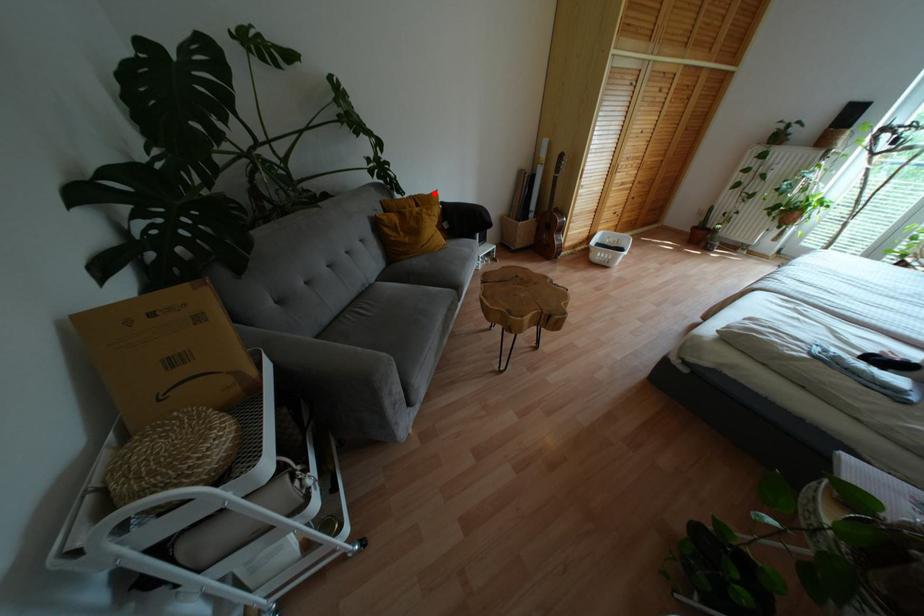
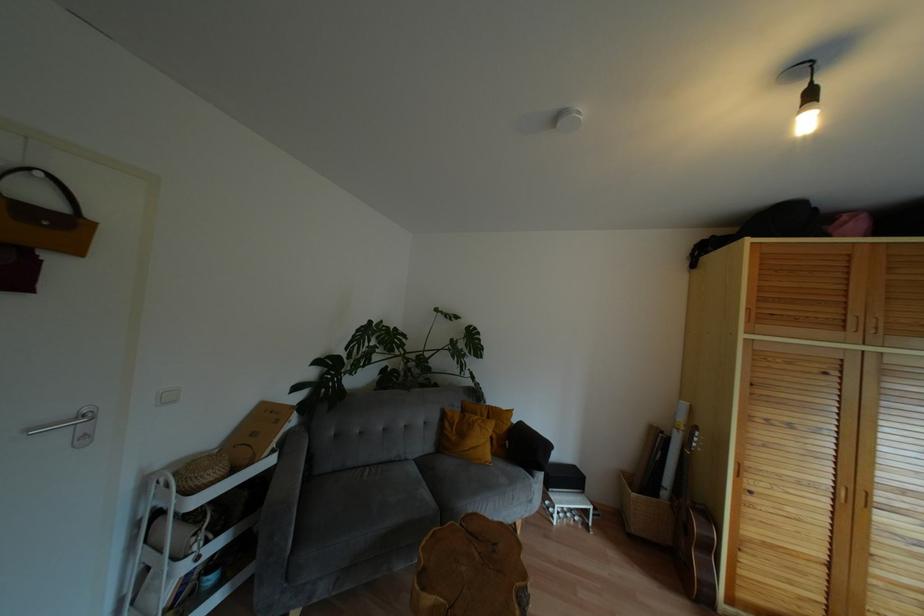
Question: I am providing you with two images of the same scene from different viewpoints. Image1 has a red point marked. In image2, the corresponding 3D location appears at what relative position? Reply with the corresponding letter.

Choices:
 (A) Closer
 (B) Farther

Answer: (B)